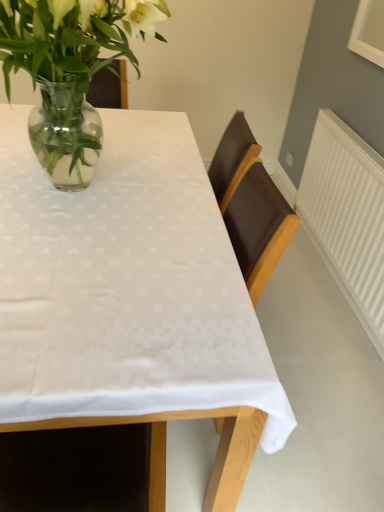
Question: Considering the positions of clear glass vase at upper left and white fabric table at center in the image, is clear glass vase at upper left taller or shorter than white fabric table at center?

Choices:
 (A) short
 (B) tall

Answer: (A)

Question: Considering the positions of clear glass vase at upper left and white fabric table at center in the image, is clear glass vase at upper left wider or thinner than white fabric table at center?

Choices:
 (A) wide
 (B) thin

Answer: (B)

Question: Based on their sizes in the image, would you say clear glass vase at upper left is bigger or smaller than white fabric table at center?

Choices:
 (A) big
 (B) small

Answer: (B)

Question: From the image's perspective, is white fabric table at center located above or below clear glass vase at upper left?

Choices:
 (A) above
 (B) below

Answer: (B)

Question: Is white fabric table at center bigger or smaller than clear glass vase at upper left?

Choices:
 (A) small
 (B) big

Answer: (B)

Question: In the image, is white fabric table at center on the left side or the right side of clear glass vase at upper left?

Choices:
 (A) left
 (B) right

Answer: (A)

Question: Choose the correct answer: Is white fabric table at center inside clear glass vase at upper left or outside it?

Choices:
 (A) inside
 (B) outside

Answer: (B)